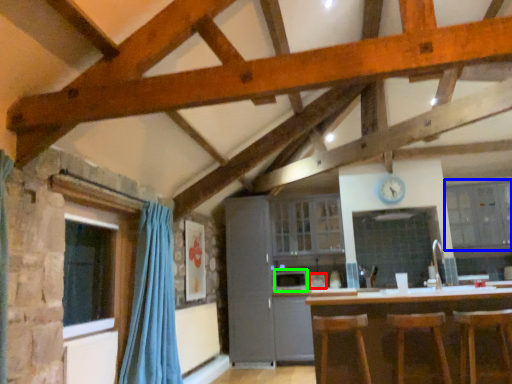
Question: Considering the real-world distances, which object is closest to appliance (highlighted by a red box)? cabinetry (highlighted by a blue box) or appliance (highlighted by a green box).

Choices:
 (A) cabinetry
 (B) appliance

Answer: (B)